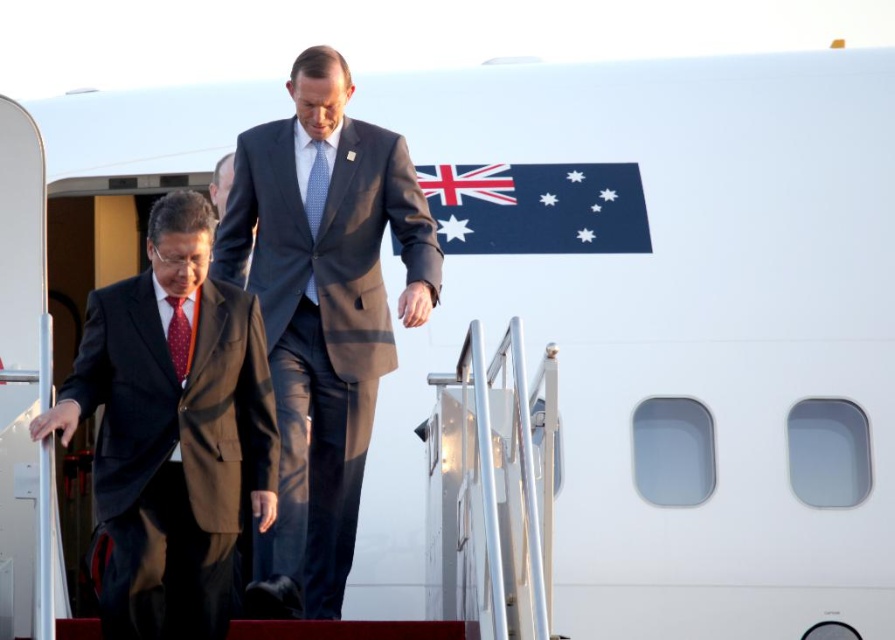
Question: Is dark blue suit at center above red dotted tie at left?

Choices:
 (A) no
 (B) yes

Answer: (A)

Question: Which of the following is the closest to the observer?

Choices:
 (A) (183, 362)
 (B) (279, 506)

Answer: (A)

Question: Which point is closer to the camera taking this photo?

Choices:
 (A) (328, 124)
 (B) (314, 304)
 (C) (175, 349)
 (D) (109, 387)

Answer: (D)

Question: Considering the real-world distances, which object is farthest from the matte black suit at left?

Choices:
 (A) blue dotted fabric tie at center
 (B) dark blue suit at center

Answer: (A)

Question: Does dark blue suit at center appear over red dotted tie at left?

Choices:
 (A) no
 (B) yes

Answer: (A)

Question: Considering the relative positions of matte black suit at left and red dotted tie at left in the image provided, where is matte black suit at left located with respect to red dotted tie at left?

Choices:
 (A) left
 (B) right

Answer: (B)